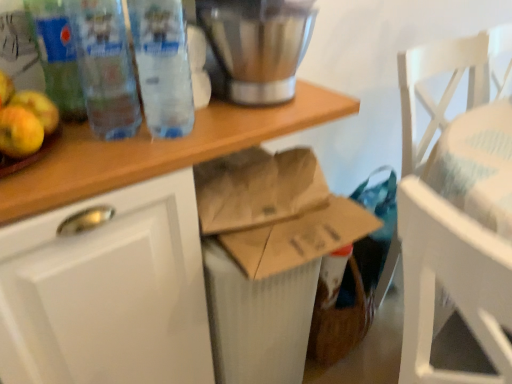
Question: From a real-world perspective, is brown paper bag at center above or below stainless steel blender at upper center?

Choices:
 (A) above
 (B) below

Answer: (B)

Question: Is brown paper bag at center wider or thinner than stainless steel blender at upper center?

Choices:
 (A) wide
 (B) thin

Answer: (A)

Question: Considering the real-world distances, which object is farthest from the transparent plastic bottle at upper left, the 2th bottle in the right-to-left sequence?

Choices:
 (A) translucent plastic bottle at left, marked as the 3th bottle in a right-to-left arrangement
 (B) stainless steel blender at upper center
 (C) transparent plastic bottles at upper left, arranged as the 1th bottle when viewed from the right
 (D) brown paper bag at center
 (E) yellow matte apple at left

Answer: (B)

Question: Based on their relative distances, which object is farther from the transparent plastic bottle at upper left, acting as the 2th bottle starting from the left?

Choices:
 (A) translucent plastic bottle at left, marked as the 3th bottle in a right-to-left arrangement
 (B) brown paper bag at center
 (C) yellow matte apple at left
 (D) stainless steel blender at upper center
 (E) transparent plastic bottles at upper left, the 3th bottle from the left

Answer: (D)